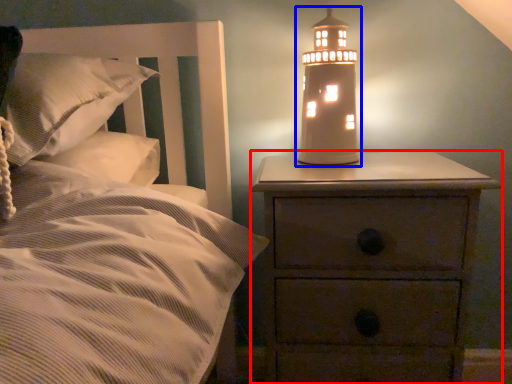
Question: Which point is further to the camera, nightstand (highlighted by a red box) or oil lamp (highlighted by a blue box)?

Choices:
 (A) nightstand
 (B) oil lamp

Answer: (B)